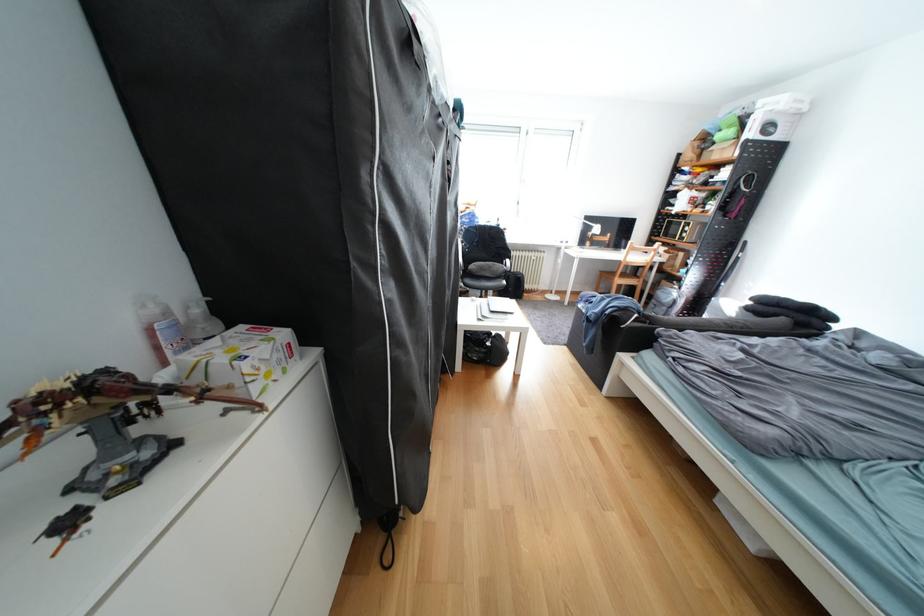
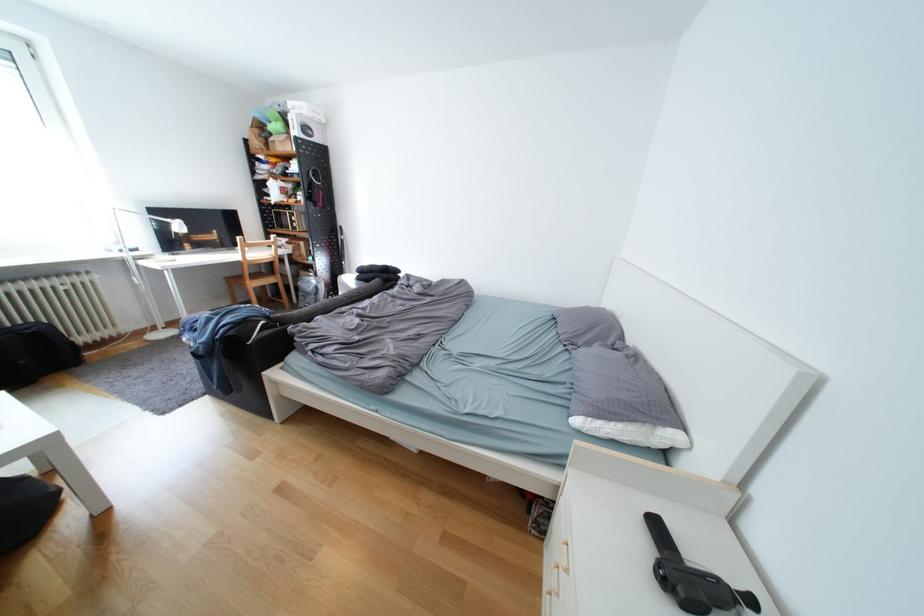
Find the pixel in the second image that matches (x=665, y=302) in the first image.

(313, 294)